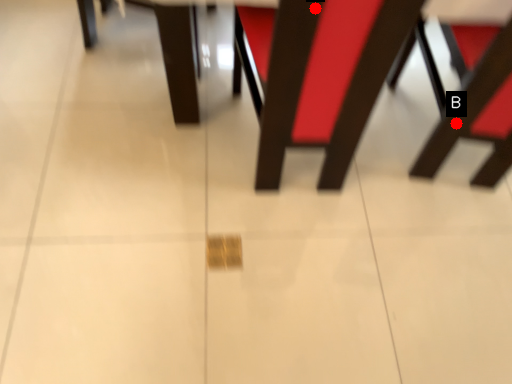
Question: Two points are circled on the image, labeled by A and B beside each circle. Which of the following is the farthest from the observer?

Choices:
 (A) A is further
 (B) B is further

Answer: (B)